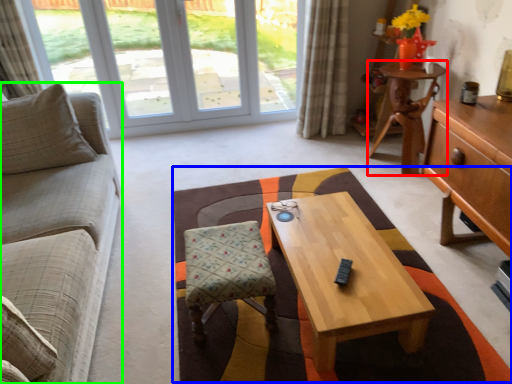
Question: Which is nearer to the desk (highlighted by a red box)? blanket (highlighted by a blue box) or studio couch (highlighted by a green box).

Choices:
 (A) blanket
 (B) studio couch

Answer: (A)